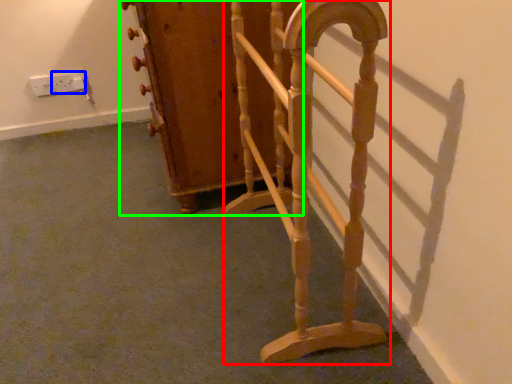
Question: Estimate the real-world distances between objects in this image. Which object is closer to furniture (highlighted by a red box), electric outlet (highlighted by a blue box) or furniture (highlighted by a green box)?

Choices:
 (A) electric outlet
 (B) furniture

Answer: (B)